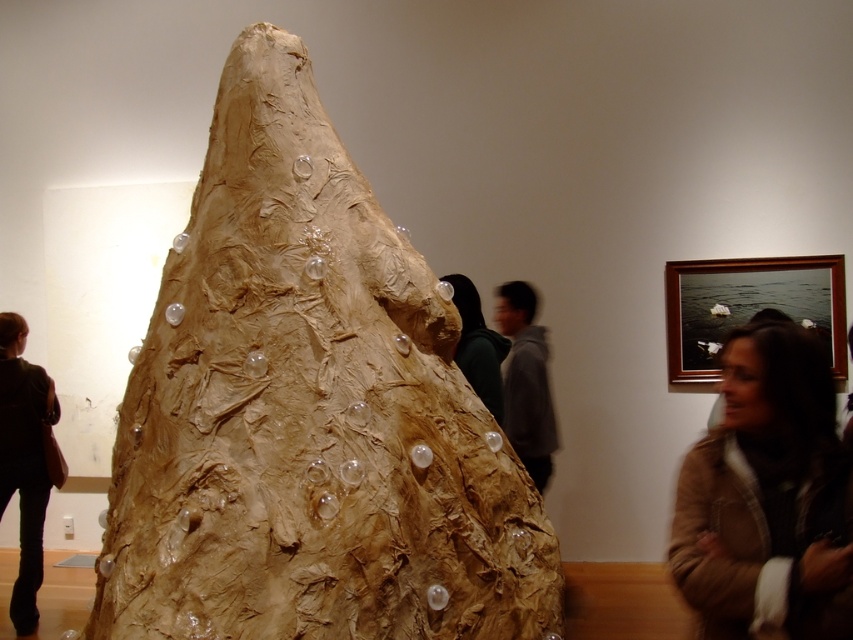
Who is lower down, matte brown sculpture at center or brown textured jacket at lower right?

brown textured jacket at lower right is lower down.

Is matte brown sculpture at center closer to camera compared to brown textured jacket at lower right?

Yes, it is.

Between point (167, 586) and point (825, 369), which one is positioned in front?

Point (167, 586) is more forward.

Locate an element on the screen. The width and height of the screenshot is (853, 640). matte brown sculpture at center is located at coordinates (308, 412).